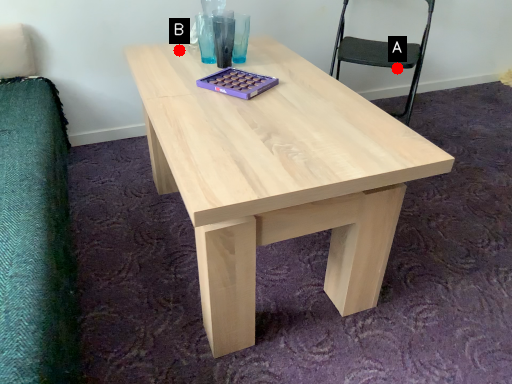
Question: Two points are circled on the image, labeled by A and B beside each circle. Which point is farther from the camera taking this photo?

Choices:
 (A) A is further
 (B) B is further

Answer: (A)